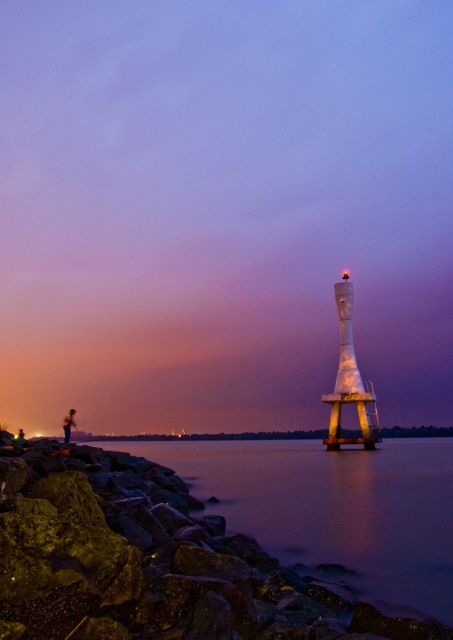
Does white glossy tower at center lie in front of metallic figure at lower left?

No, white glossy tower at center is further to the viewer.

Measure the distance between point (341, 291) and camera.

Point (341, 291) is 155.20 meters from camera.

At what (x,y) coordinates should I click in order to perform the action: click on white glossy tower at center. Please return your answer as a coordinate pair (x, y). This screenshot has height=640, width=453. Looking at the image, I should click on (350, 380).

Can you confirm if smooth water at lower left is positioned above metallic figure at lower left?

No, smooth water at lower left is not above metallic figure at lower left.

Is point (405, 518) more distant than point (66, 420)?

No, (405, 518) is in front of (66, 420).

Identify the location of smooth water at lower left. The image size is (453, 640). (333, 506).

Can you confirm if smooth water at lower left is shorter than white glossy tower at center?

Yes.

Which is above, smooth water at lower left or white glossy tower at center?

Positioned higher is white glossy tower at center.

This screenshot has height=640, width=453. Find the location of `smooth water at lower left`. smooth water at lower left is located at coordinates (333, 506).

Identify the location of smooth water at lower left. The width and height of the screenshot is (453, 640). (333, 506).